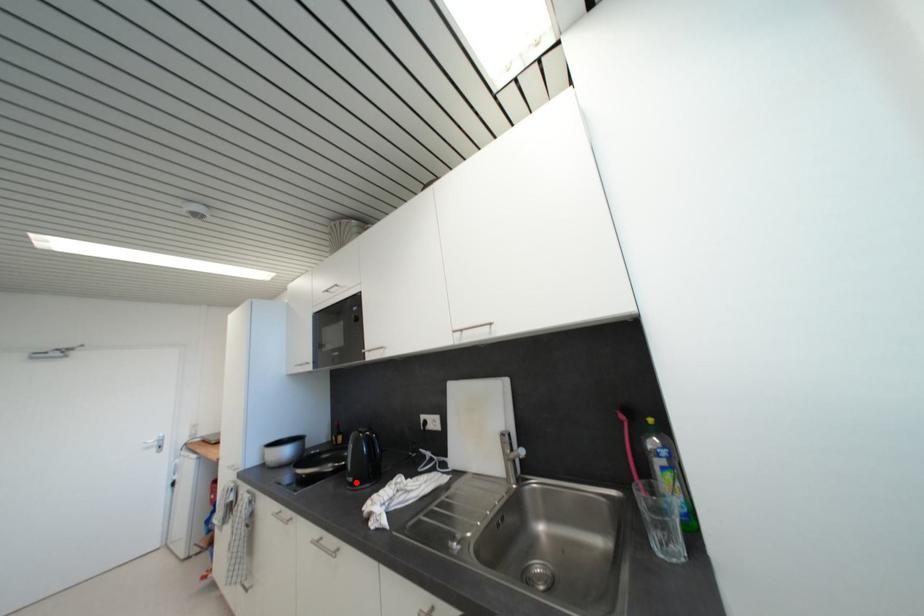
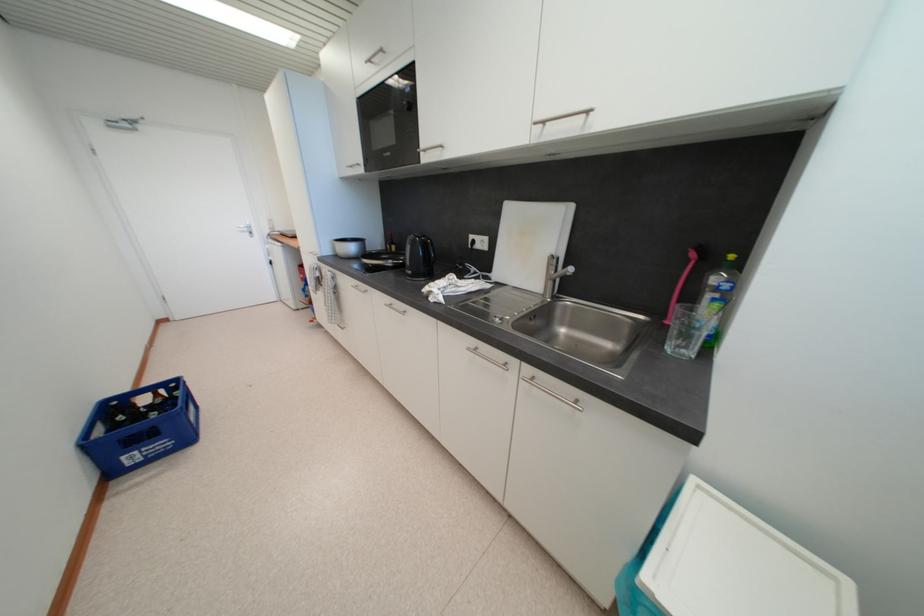
Question: I am providing you with two images of the same scene from different viewpoints. Given a red point in image1, look at the same physical point in image2. Is it:

Choices:
 (A) Closer to the viewpoint
 (B) Farther from the viewpoint

Answer: (A)